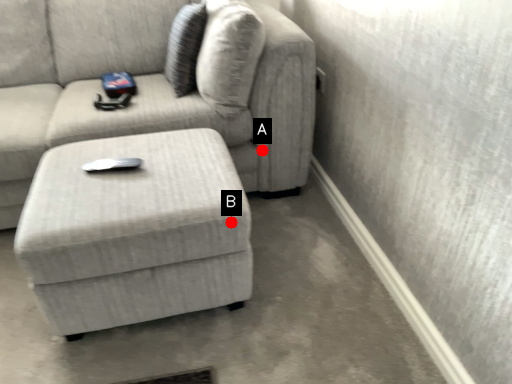
Question: Two points are circled on the image, labeled by A and B beside each circle. Among these points, which one is nearest to the camera?

Choices:
 (A) A is closer
 (B) B is closer

Answer: (B)